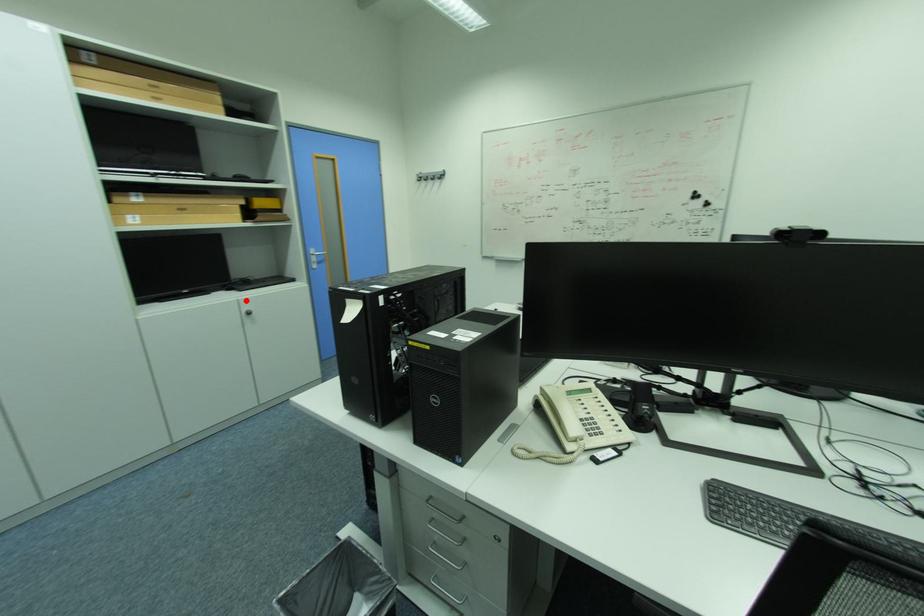
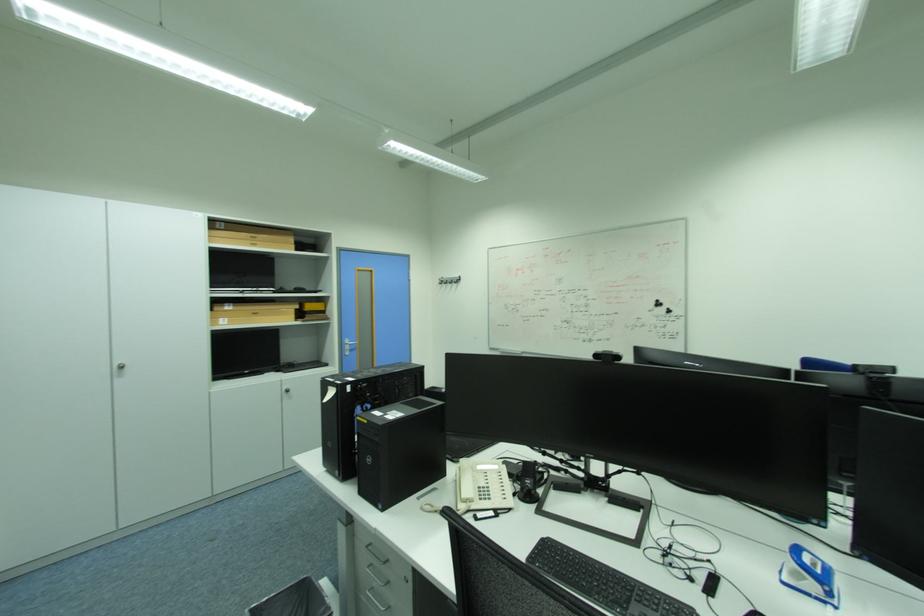
In the second image, find the point that corresponds to the highlighted location in the first image.

(289, 379)